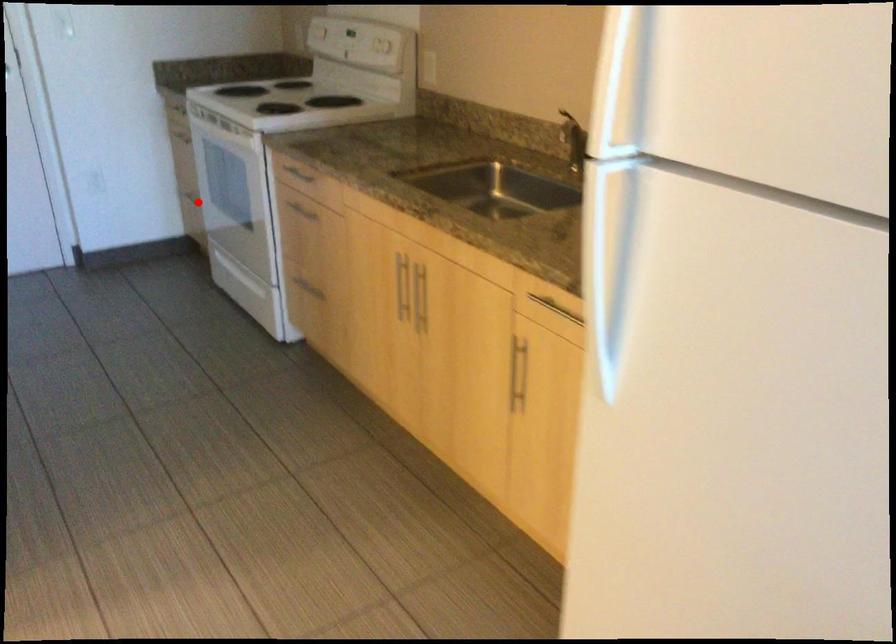
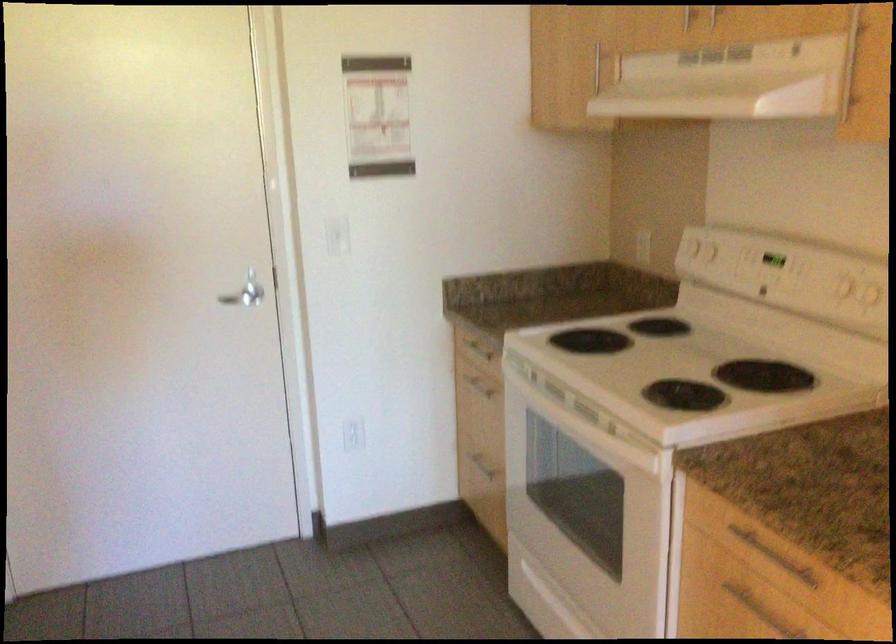
Question: A red point is marked in image1. In image2, is the corresponding 3D point closer to the camera or farther? Reply with the corresponding letter.

Choices:
 (A) The corresponding 3D point is closer.
 (B) The corresponding 3D point is farther.

Answer: (A)